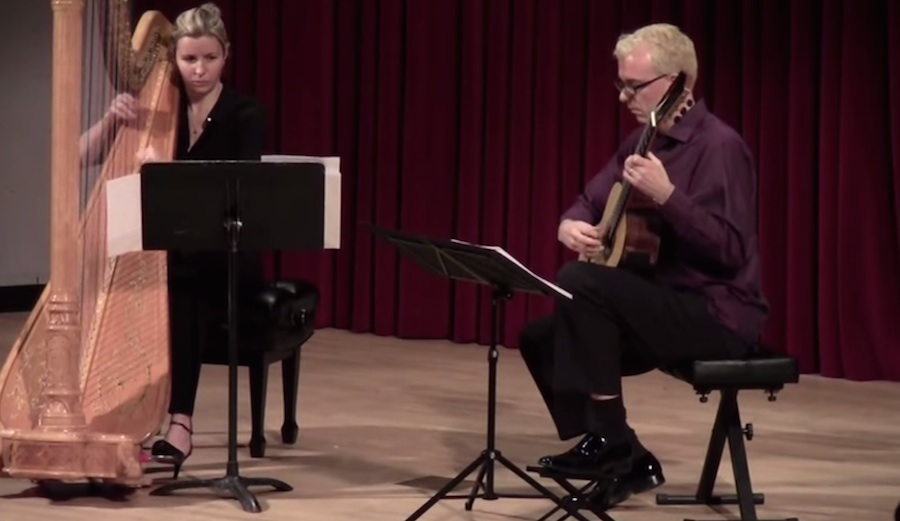
Locate an element on the screen. music stand is located at coordinates (300, 234).